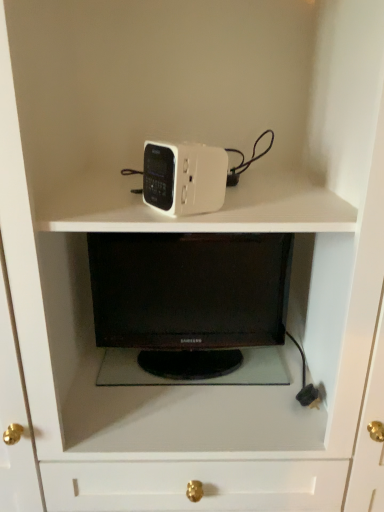
Question: Considering the positions of point click(213, 156) and point click(193, 324), is point click(213, 156) closer or farther from the camera than point click(193, 324)?

Choices:
 (A) closer
 (B) farther

Answer: (A)

Question: From a real-world perspective, is white plastic clock at upper center above or below black glossy desktop at center?

Choices:
 (A) below
 (B) above

Answer: (B)

Question: From the image's perspective, relative to black glossy desktop at center, is white plastic clock at upper center above or below?

Choices:
 (A) below
 (B) above

Answer: (B)

Question: Do you think black glossy desktop at center is within white plastic clock at upper center, or outside of it?

Choices:
 (A) outside
 (B) inside

Answer: (A)

Question: Is black glossy desktop at center taller or shorter than white plastic clock at upper center?

Choices:
 (A) short
 (B) tall

Answer: (B)

Question: Considering the positions of point (135, 334) and point (157, 200), is point (135, 334) closer or farther from the camera than point (157, 200)?

Choices:
 (A) farther
 (B) closer

Answer: (A)

Question: From a real-world perspective, relative to white plastic clock at upper center, is black glossy desktop at center vertically above or below?

Choices:
 (A) below
 (B) above

Answer: (A)